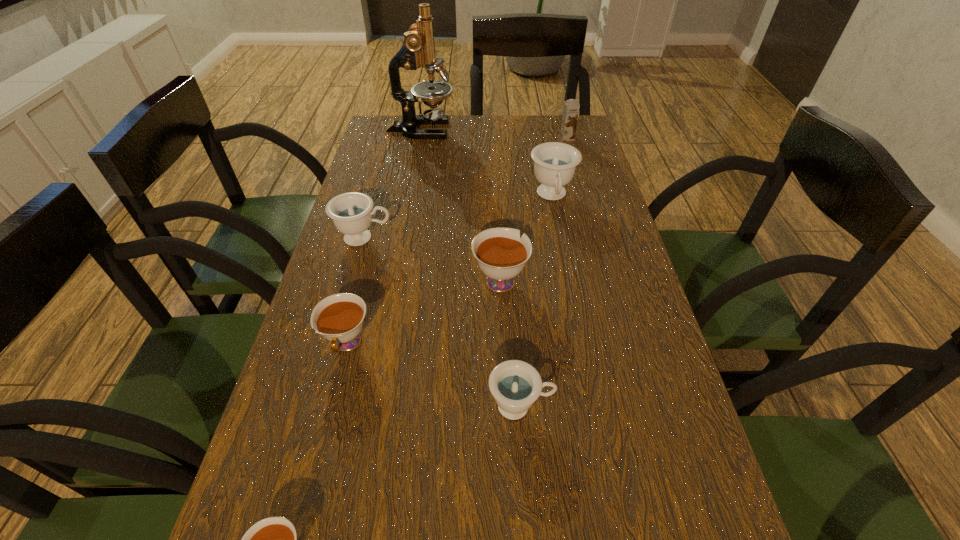
Locate an element on the screen. object that is the seventh closest one to the third farthest object is located at coordinates (274, 539).

Locate an element on the screen. teacup that is the second closest to the chocolate milk is located at coordinates (501, 254).

Locate an element on the screen. The width and height of the screenshot is (960, 540). teacup that is the third nearest to the sixth farthest object is located at coordinates [x=516, y=385].

Locate which blue teacup ranks third in proximity to the chocolate milk. Please provide its 2D coordinates. Your answer should be formatted as a tuple, i.e. [(x, y)], where the tuple contains the x and y coordinates of a point satisfying the conditions above.

[(516, 385)]

Locate an element on the screen. blue teacup that is the closest one to the biggest blue teacup is located at coordinates (351, 213).

At what (x,y) coordinates should I click in order to perform the action: click on white teacup identified as the closest to the fourth nearest teacup. Please return your answer as a coordinate pair (x, y). This screenshot has width=960, height=540. Looking at the image, I should click on (339, 318).

At what (x,y) coordinates should I click in order to perform the action: click on white teacup that stands as the closest to the second farthest blue teacup. Please return your answer as a coordinate pair (x, y). The height and width of the screenshot is (540, 960). Looking at the image, I should click on (501, 254).

Find the location of `free space that satisfies the following two spatial constraints: 1. at the eyepiece of the microscope; 2. on the side of the third nearest teacup with the handle`. free space that satisfies the following two spatial constraints: 1. at the eyepiece of the microscope; 2. on the side of the third nearest teacup with the handle is located at coordinates (381, 344).

Locate an element on the screen. The height and width of the screenshot is (540, 960). blank space that satisfies the following two spatial constraints: 1. on the front side of the chocolate milk; 2. on the side of the leftmost blue teacup with the handle is located at coordinates (594, 238).